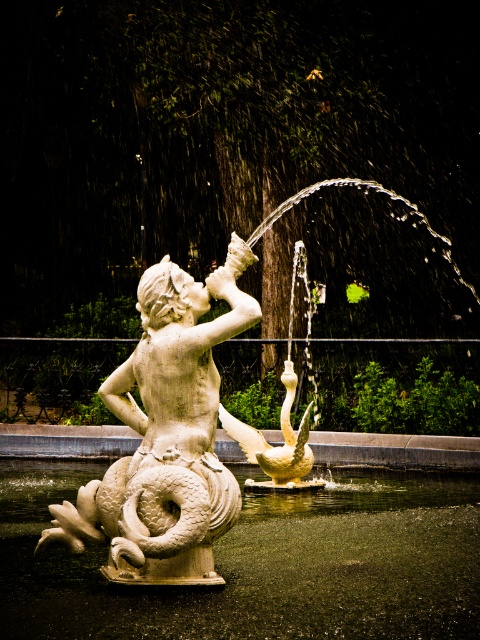
Based on the scene description, where is the white stone water at lower center located in the image?

The white stone water at lower center is located at point coordinates of approximately 0.883 on the x axis and 0.544 on the y axis.

In the classical fountain scene, there is a white stone water at lower center and a white stone fountain at center. From the perspective of someone standing in front of the fountain, which object is positioned to the left?

The white stone water at lower center is to the left of the white stone fountain at center.

Based on the photo, you are a photographer trying to capture the white stone fountain at center and the white stone mermaid at center in a single shot. Given that your camera can only focus on one object at a time, which object should you prioritize focusing on to ensure it appears sharp and clear in the photo?

The white stone fountain at center has a larger size compared to the white stone mermaid at center, so you should prioritize focusing on the white stone fountain at center to ensure it appears sharp and clear in the photo.